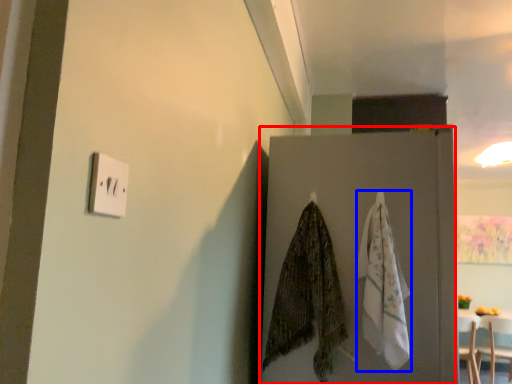
Question: Which object appears farthest to the camera in this image, door (highlighted by a red box) or blanket (highlighted by a blue box)?

Choices:
 (A) door
 (B) blanket

Answer: (A)